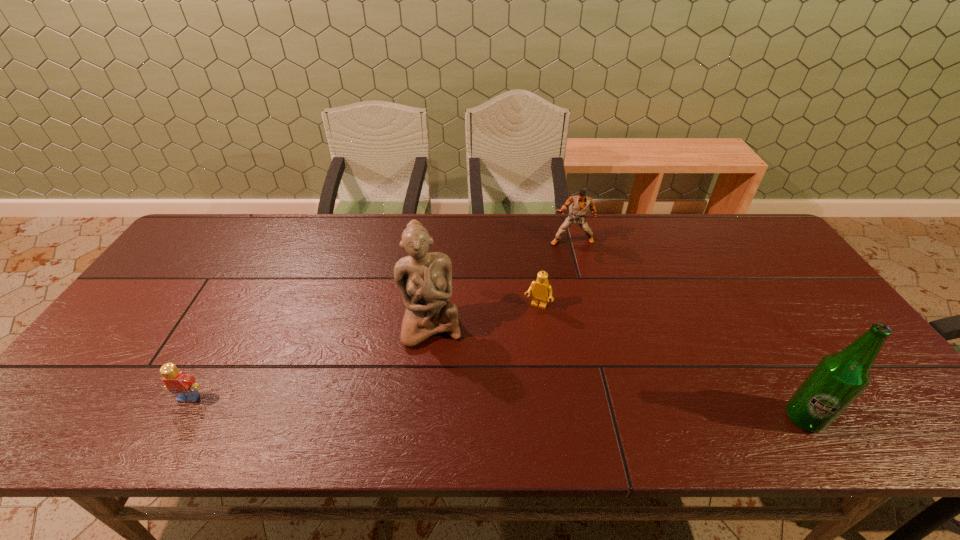
Locate an element on the screen. The width and height of the screenshot is (960, 540). the left Lego is located at coordinates (177, 382).

Locate an element on the screen. The image size is (960, 540). the nearer Lego is located at coordinates (177, 382).

In order to click on the rightmost object in this screenshot , I will do `click(838, 379)`.

You are a GUI agent. You are given a task and a screenshot of the screen. Output one action in this format:
    pyautogui.click(x=<x>, y=<y>)
    Task: Click on the right Lego
    The height and width of the screenshot is (540, 960).
    Given the screenshot: What is the action you would take?
    pyautogui.click(x=541, y=288)

This screenshot has height=540, width=960. Find the location of `the farther Lego`. the farther Lego is located at coordinates (541, 288).

Locate an element on the screen. The image size is (960, 540). the third shortest object is located at coordinates (580, 205).

Image resolution: width=960 pixels, height=540 pixels. Find the location of `the farthest object`. the farthest object is located at coordinates click(x=580, y=205).

What are the coordinates of `figurine` in the screenshot? It's located at (424, 279).

Find the location of a particular element. The width and height of the screenshot is (960, 540). blank area located on the face of the right Lego is located at coordinates (527, 327).

The height and width of the screenshot is (540, 960). What are the coordinates of `free space located on the face of the right Lego` in the screenshot? It's located at tap(516, 352).